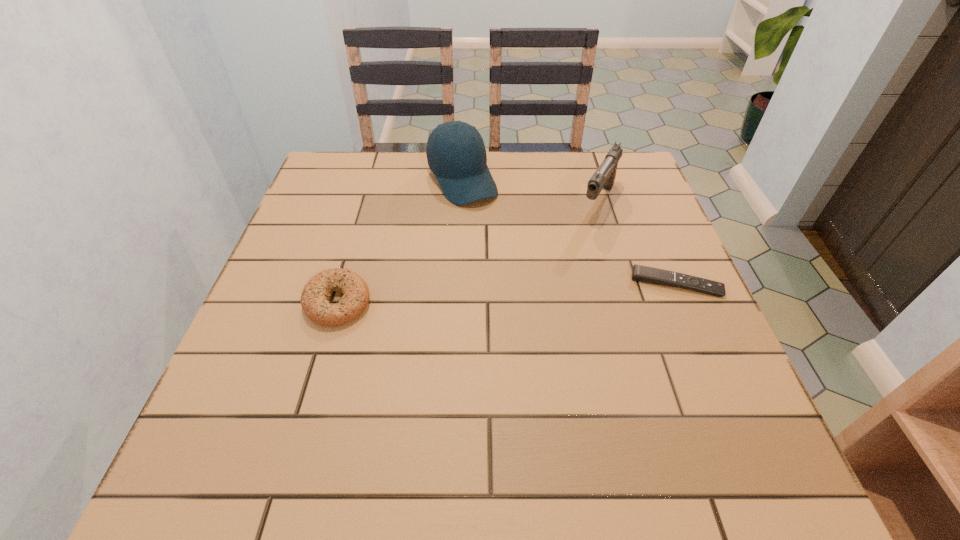
Where is `free space at the near edge of the desktop`? The image size is (960, 540). free space at the near edge of the desktop is located at coordinates (394, 427).

Find the location of a particular element. vacant space at the left edge is located at coordinates (241, 345).

Locate an element on the screen. This screenshot has height=540, width=960. free region at the right edge of the desktop is located at coordinates (653, 202).

In the image, there is a desktop. Where is `free space at the near left corner`? free space at the near left corner is located at coordinates (225, 383).

Find the location of a particular element. The width and height of the screenshot is (960, 540). vacant space at the far right corner of the desktop is located at coordinates (610, 191).

In the image, there is a desktop. Identify the location of vacant space at the near right corner. The height and width of the screenshot is (540, 960). (686, 411).

Locate an element on the screen. The width and height of the screenshot is (960, 540). vacant space that is in between the shortest object and the second shortest object is located at coordinates (507, 293).

You are a GUI agent. You are given a task and a screenshot of the screen. Output one action in this format:
    pyautogui.click(x=<x>, y=<y>)
    Task: Click on the free space between the remote control and the baseball cap
    
    Given the screenshot: What is the action you would take?
    pyautogui.click(x=569, y=232)

You are a GUI agent. You are given a task and a screenshot of the screen. Output one action in this format:
    pyautogui.click(x=<x>, y=<y>)
    Task: Click on the empty space between the shortest object and the leftmost object
    
    Given the screenshot: What is the action you would take?
    pyautogui.click(x=507, y=293)

Where is `free spot between the shortest object and the gun`? free spot between the shortest object and the gun is located at coordinates (637, 242).